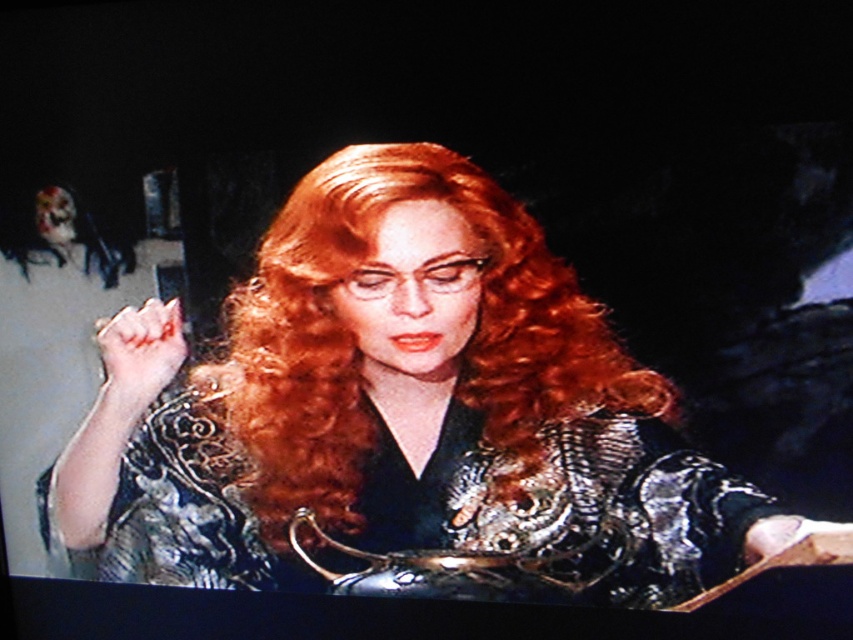
Can you confirm if shiny silver armor at center is bigger than metallic silver dress at center?

Yes, shiny silver armor at center is bigger than metallic silver dress at center.

Is point (495, 470) positioned behind point (553, 461)?

Yes, it is.

Identify the location of shiny silver armor at center. This screenshot has height=640, width=853. (397, 419).